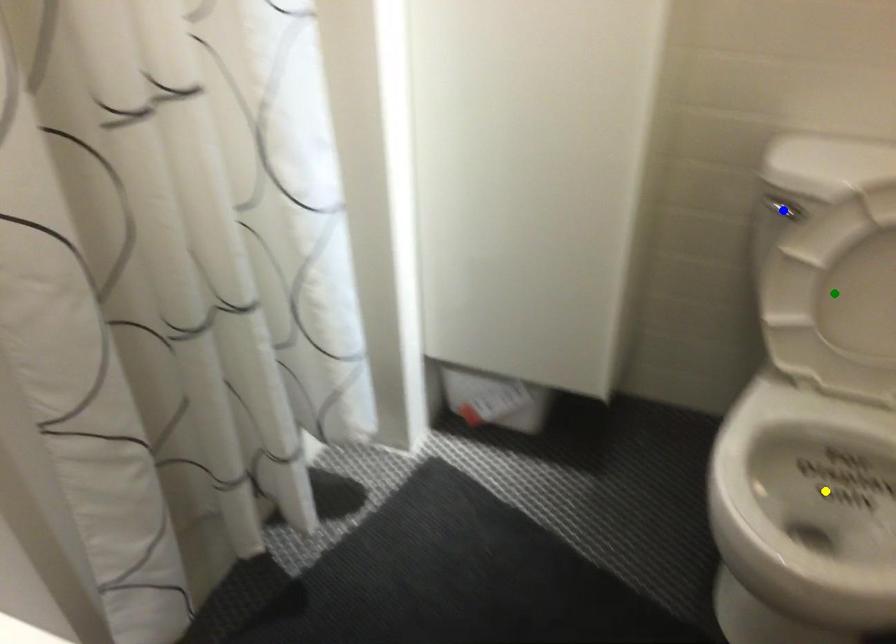
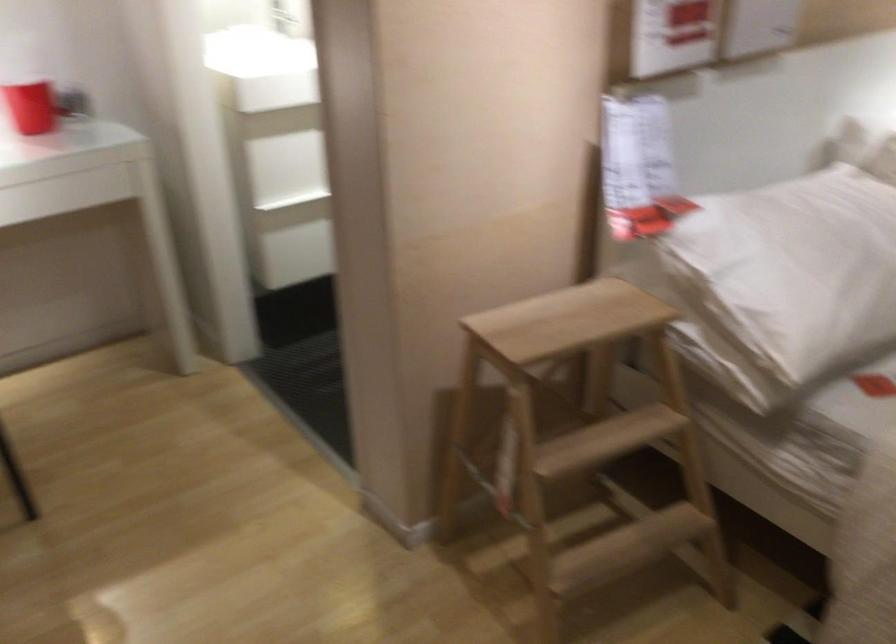
I am providing you with two images of the same scene from different viewpoints. Three points are marked in image1. Which point corresponds to a part or object that is occluded in image2?In image1, three points are marked. Which of them correspond to a part or object that is occluded in image2?Among the three points shown in image1, which one corresponds to a part or object that is no longer visible due to occlusion in image2?

yellow point, green point, blue point